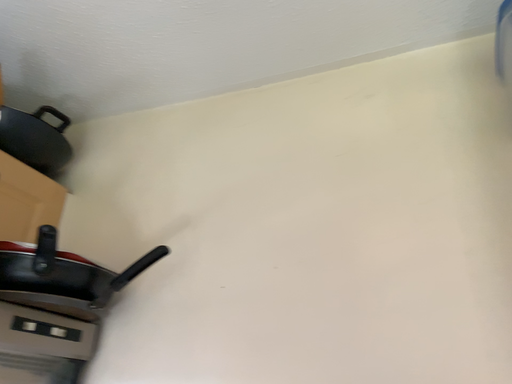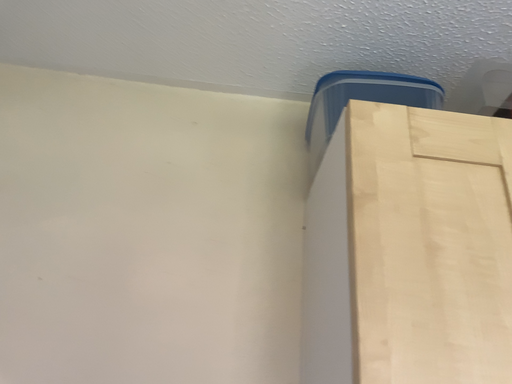
Question: How did the camera likely rotate when shooting the video?

Choices:
 (A) rotated right
 (B) rotated left

Answer: (A)